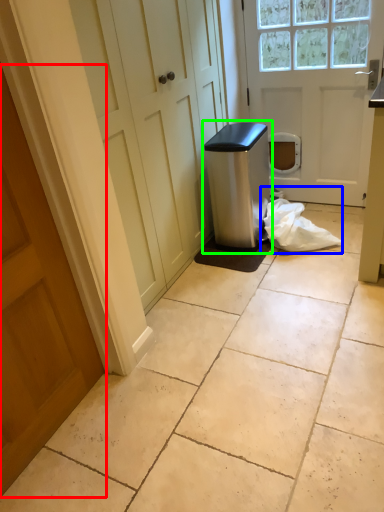
Question: Which is farther away from door (highlighted by a red box)? material (highlighted by a blue box) or water cooler (highlighted by a green box)?

Choices:
 (A) material
 (B) water cooler

Answer: (A)